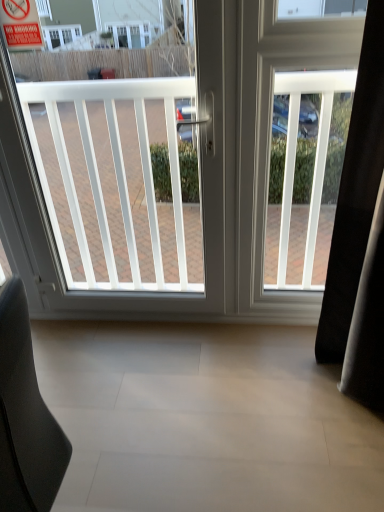
Question: In terms of width, does black leather chair at lower left look wider or thinner when compared to white plastic screen door at right?

Choices:
 (A) thin
 (B) wide

Answer: (B)

Question: From the image's perspective, is black leather chair at lower left positioned above or below white plastic screen door at right?

Choices:
 (A) below
 (B) above

Answer: (A)

Question: Estimate the real-world distances between objects in this image. Which object is closer to the white plastic screen door at right?

Choices:
 (A) red plastic sign at upper left
 (B) black leather chair at lower left
 (C) white plastic window at center

Answer: (C)

Question: Which object is the farthest from the red plastic sign at upper left?

Choices:
 (A) black leather chair at lower left
 (B) white plastic screen door at right
 (C) white plastic window at center

Answer: (A)